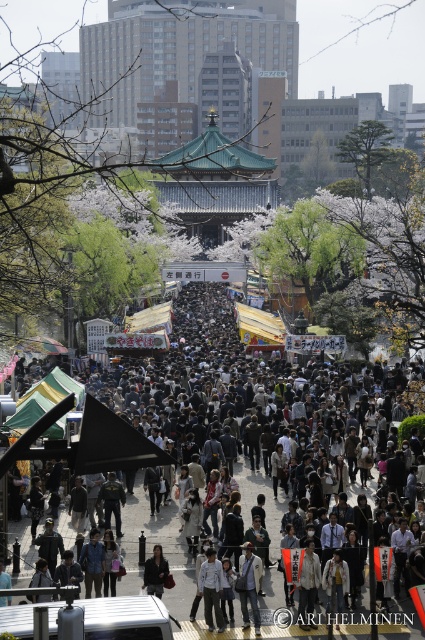
Can you confirm if light brown leather jacket at center is shorter than dark gray fabric coat at center?

Yes, light brown leather jacket at center is shorter than dark gray fabric coat at center.

Who is lower down, light brown leather jacket at center or dark gray fabric coat at center?

Positioned lower is light brown leather jacket at center.

What are the coordinates of `light brown leather jacket at center` in the screenshot? It's located at (249, 584).

Is dark gray jacket at center to the right of light gray fabric jacket at center from the viewer's perspective?

In fact, dark gray jacket at center is to the left of light gray fabric jacket at center.

Is point (379, 486) positioned behind point (215, 611)?

Yes, point (379, 486) is farther from viewer.

At what (x,y) coordinates should I click in order to perform the action: click on dark gray jacket at center. Please return your answer as a coordinate pair (x, y). Looking at the image, I should click on (207, 320).

Is light gray fabric jacket at center shorter than dark gray fabric coat at center?

Answer: In fact, light gray fabric jacket at center may be taller than dark gray fabric coat at center.

Is light gray fabric jacket at center further to camera compared to dark gray fabric coat at center?

No.

Does point (210, 600) lie in front of point (147, 576)?

Yes.

Where is `light gray fabric jacket at center`? light gray fabric jacket at center is located at coordinates (210, 588).